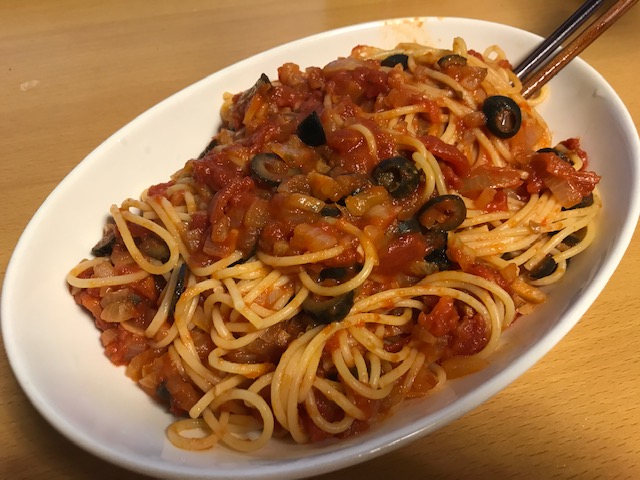
I want to click on white plate, so click(27, 364).